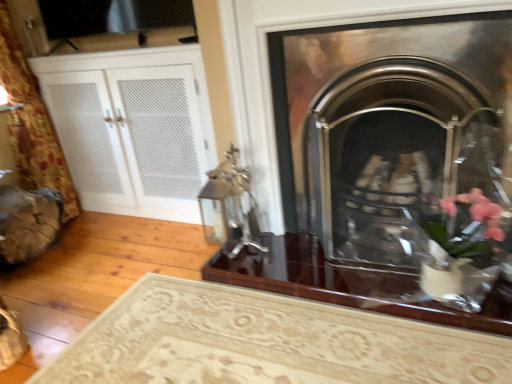
Question: Is the position of white mesh cabinet at left more distant than that of polished chrome fireplace at center, positioned as the second fireplace in bottom-to-top order?

Choices:
 (A) yes
 (B) no

Answer: (A)

Question: Is the surface of white mesh cabinet at left in direct contact with polished chrome fireplace at center, arranged as the 1th fireplace when viewed from the top?

Choices:
 (A) yes
 (B) no

Answer: (B)

Question: Is white mesh cabinet at left bigger than polished chrome fireplace at center, positioned as the second fireplace in bottom-to-top order?

Choices:
 (A) yes
 (B) no

Answer: (A)

Question: Does white mesh cabinet at left appear on the right side of polished chrome fireplace at center, positioned as the second fireplace in bottom-to-top order?

Choices:
 (A) no
 (B) yes

Answer: (A)

Question: From a real-world perspective, does white mesh cabinet at left stand above polished chrome fireplace at center, arranged as the 1th fireplace when viewed from the top?

Choices:
 (A) yes
 (B) no

Answer: (B)

Question: Visually, is glossy dark wood table at center positioned to the left or to the right of wooden log at lower left?

Choices:
 (A) left
 (B) right

Answer: (B)

Question: Is glossy dark wood table at center bigger or smaller than wooden log at lower left?

Choices:
 (A) big
 (B) small

Answer: (B)

Question: In the image, is glossy dark wood table at center positioned in front of or behind wooden log at lower left?

Choices:
 (A) behind
 (B) front

Answer: (B)

Question: Which is correct: glossy dark wood table at center is inside wooden log at lower left, or outside of it?

Choices:
 (A) outside
 (B) inside

Answer: (A)

Question: Based on their positions, is wooden log at lower left located to the left or right of black mesh screen at upper left?

Choices:
 (A) right
 (B) left

Answer: (B)

Question: Considering the positions of wooden log at lower left and black mesh screen at upper left in the image, is wooden log at lower left wider or thinner than black mesh screen at upper left?

Choices:
 (A) thin
 (B) wide

Answer: (B)

Question: Is wooden log at lower left inside the boundaries of black mesh screen at upper left, or outside?

Choices:
 (A) outside
 (B) inside

Answer: (A)

Question: From a real-world perspective, is wooden log at lower left positioned above or below black mesh screen at upper left?

Choices:
 (A) above
 (B) below

Answer: (B)

Question: Considering the positions of point (441, 158) and point (11, 253), is point (441, 158) closer or farther from the camera than point (11, 253)?

Choices:
 (A) closer
 (B) farther

Answer: (A)

Question: In terms of size, does polished metal fireplace at center, arranged as the 1th fireplace when ordered from the bottom, appear bigger or smaller than wooden log at lower left?

Choices:
 (A) big
 (B) small

Answer: (A)